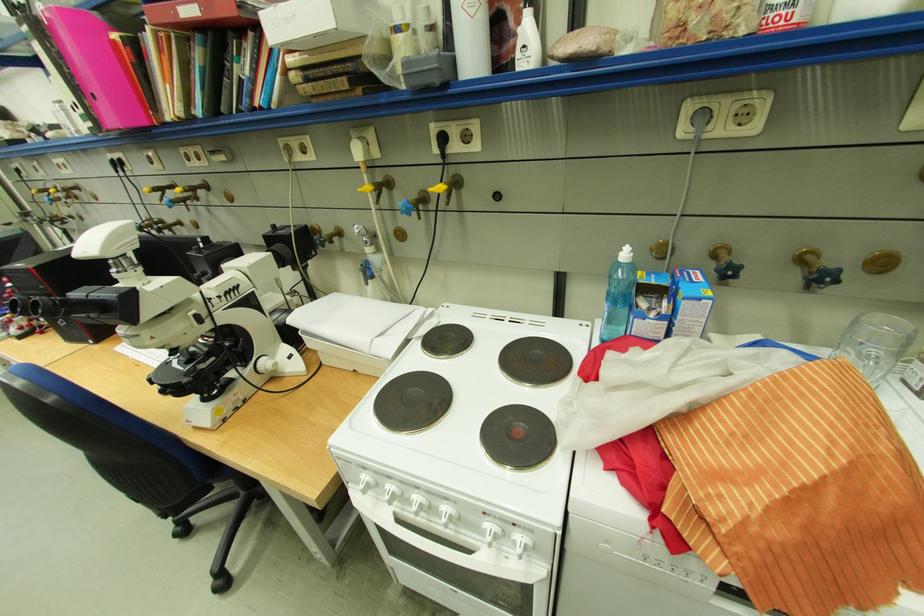
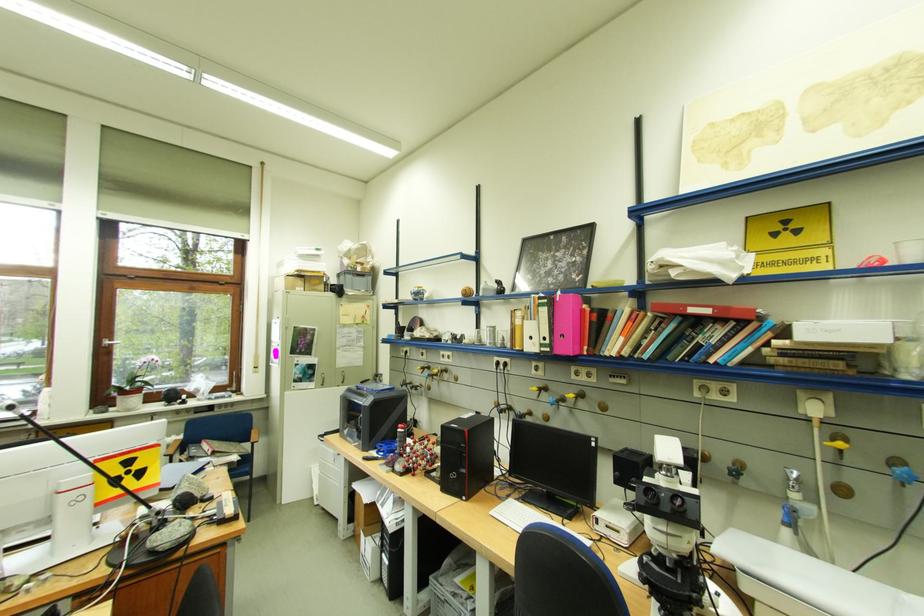
Question: I am providing you with two images of the same scene from different viewpoints. After the viewpoint changes to image2, which objects are now occluded?

Choices:
 (A) microscope focus knob
 (B) molecular model
 (C) blue tap handle
 (D) none of these

Answer: (D)